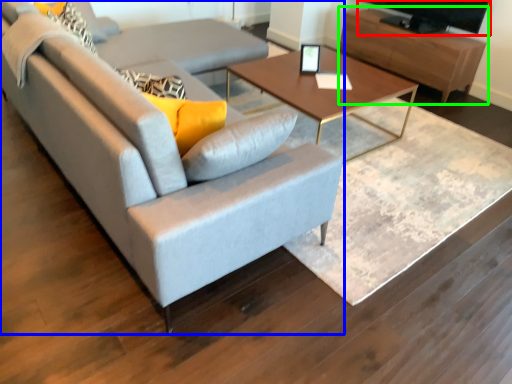
Question: Which is farther away from television (highlighted by a red box)? studio couch (highlighted by a blue box) or entertainment center (highlighted by a green box)?

Choices:
 (A) studio couch
 (B) entertainment center

Answer: (A)